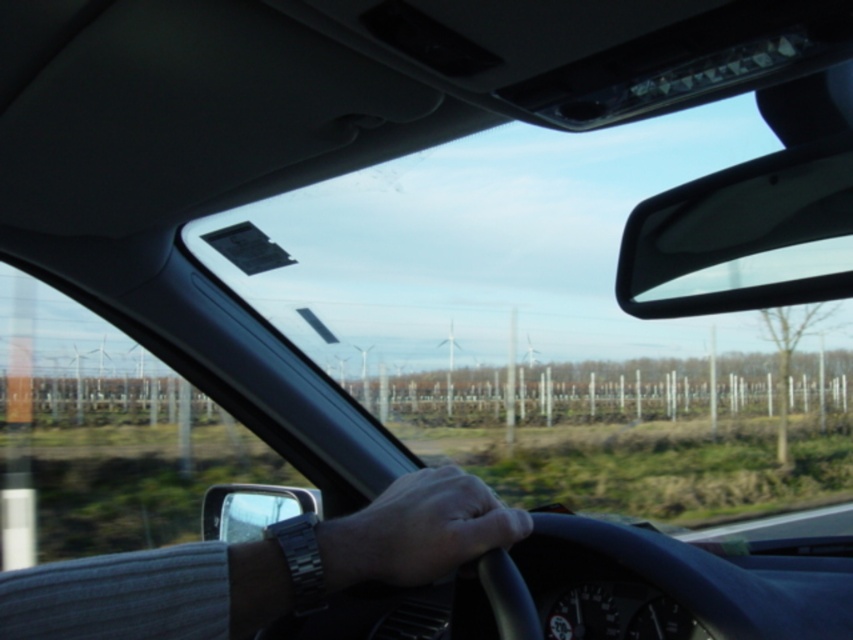
Question: Can you confirm if smooth skin hand at center is wider than clear plastic side mirror at lower left?

Choices:
 (A) yes
 (B) no

Answer: (B)

Question: Can you confirm if black glossy view mirror at upper right is bigger than smooth skin hand at center?

Choices:
 (A) no
 (B) yes

Answer: (B)

Question: Which object appears farthest from the camera in this image?

Choices:
 (A) silver metallic wristwatch at center
 (B) black glossy view mirror at upper right
 (C) smooth skin hand at center
 (D) clear plastic side mirror at lower left

Answer: (D)

Question: Which object is positioned closest to the silver metallic wristwatch at center?

Choices:
 (A) clear plastic side mirror at lower left
 (B) smooth skin hand at center
 (C) black glossy view mirror at upper right

Answer: (B)

Question: Is black glossy view mirror at upper right wider than smooth skin hand at center?

Choices:
 (A) no
 (B) yes

Answer: (B)

Question: Among these objects, which one is farthest from the camera?

Choices:
 (A) smooth skin hand at center
 (B) black glossy view mirror at upper right

Answer: (B)